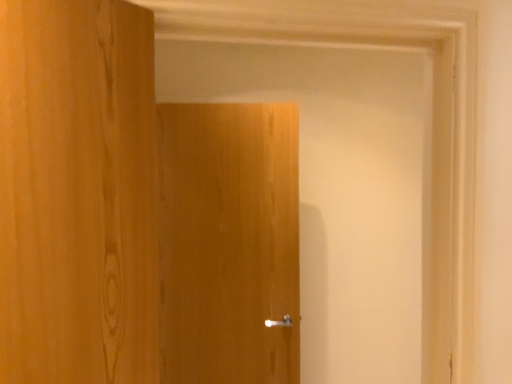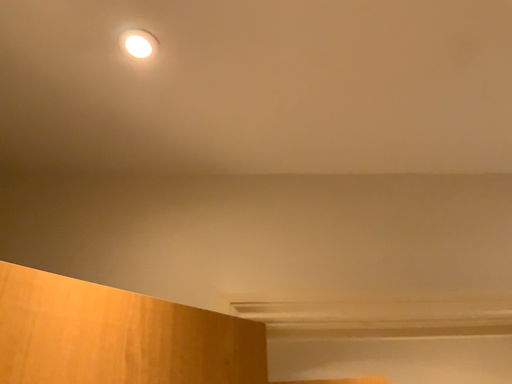
Question: How did the camera likely rotate when shooting the video?

Choices:
 (A) rotated left
 (B) rotated right

Answer: (A)